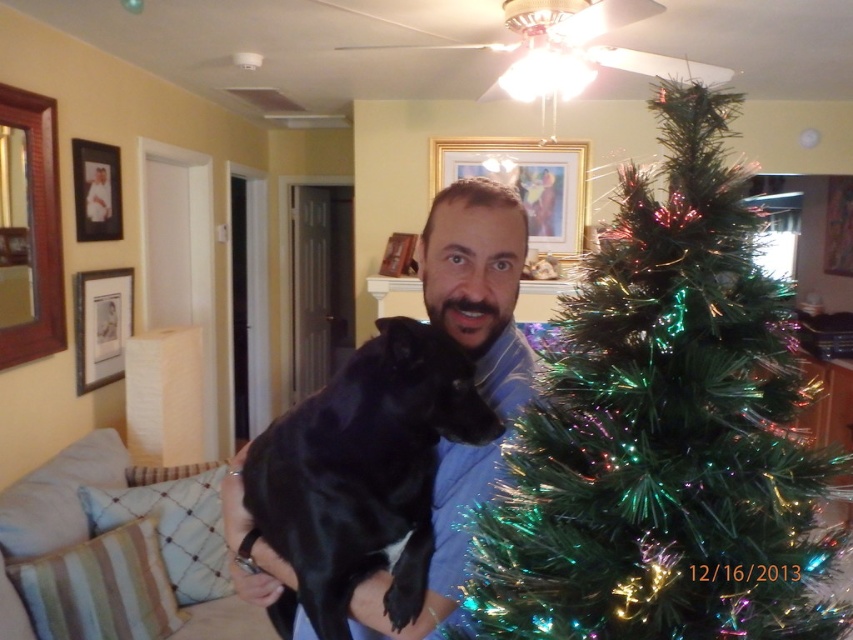
You are standing in the living room and want to place a new decoration on the iridescent green artificial tree at right. To reach the top of the tree, you need to know its height. Can you determine if the tree is taller than 6 feet based on its position in the scene?

The iridescent green artificial tree at right is located at point (663, 429) in the scene, but without specific height measurements provided, we cannot definitively determine if it is taller than 6 feet. Additional information about the room dimensions or tree size would be needed to answer this accurately.

You are standing in the living room and want to place a small decoration between the two points marked as point (x=494, y=499) and point (x=335, y=538). Which point should you move closer to ensure the decoration is placed in front?

You should move closer to point (x=494, y=499) because it is closer to you than point (x=335, y=538), which is further away.